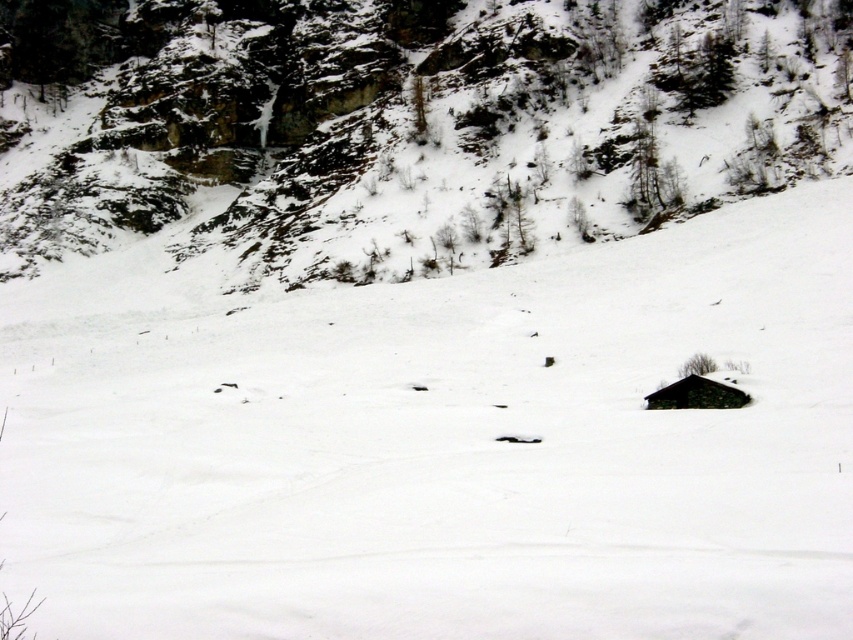
Question: Can you confirm if white matte snow at center is positioned below rocky cliff at upper left?

Choices:
 (A) no
 (B) yes

Answer: (B)

Question: Is the position of rocky cliff at upper left less distant than that of stone roof hut at lower right?

Choices:
 (A) no
 (B) yes

Answer: (A)

Question: Among these points, which one is nearest to the camera?

Choices:
 (A) (830, 371)
 (B) (706, 390)
 (C) (103, 74)

Answer: (B)

Question: Which object appears farthest from the camera in this image?

Choices:
 (A) white matte snow at center
 (B) rocky cliff at upper left

Answer: (B)

Question: Which object is the closest to the stone roof hut at lower right?

Choices:
 (A) white matte snow at center
 (B) rocky cliff at upper left

Answer: (A)

Question: Does white matte snow at center come in front of rocky cliff at upper left?

Choices:
 (A) yes
 (B) no

Answer: (A)